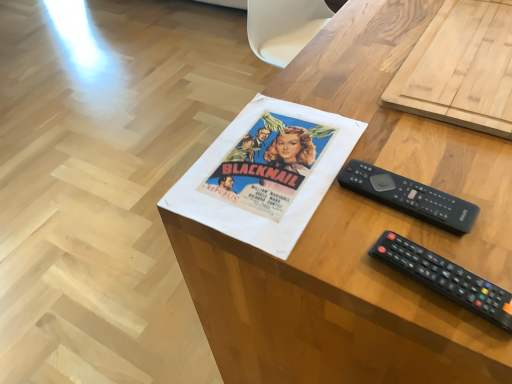
Question: Is woodendesk at center in front of or behind black plastic remote at lower right, which is the second remote control in top-to-bottom order, in the image?

Choices:
 (A) front
 (B) behind

Answer: (A)

Question: From the image's perspective, is woodendesk at center above or below black plastic remote at lower right, positioned as the first remote control in bottom-to-top order?

Choices:
 (A) below
 (B) above

Answer: (B)

Question: Which object is positioned closest to the black plastic remote at lower right, the first remote control positioned from the front?

Choices:
 (A) black plastic remote at center right, the 1th remote control when ordered from back to front
 (B) woodendesk at center

Answer: (A)

Question: Which of these objects is positioned closest to the woodendesk at center?

Choices:
 (A) black plastic remote at lower right, the first remote control positioned from the front
 (B) black plastic remote at center right, the second remote control from the bottom

Answer: (B)